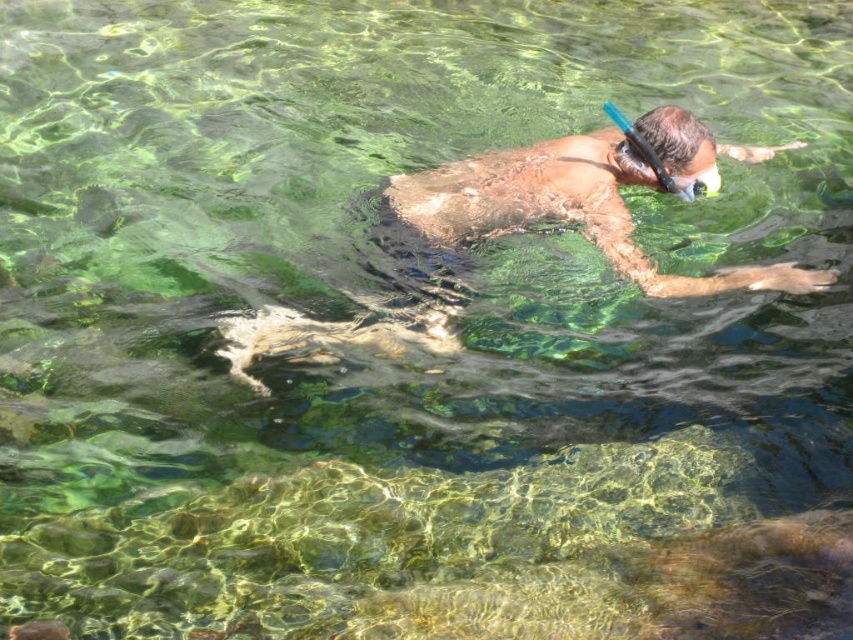
Who is lower down, smooth skin diver at center or blue rubber snorkel at upper center?

smooth skin diver at center is below.

Is smooth skin diver at center taller than blue rubber snorkel at upper center?

Yes.

Where is `smooth skin diver at center`? The image size is (853, 640). smooth skin diver at center is located at coordinates (584, 198).

This screenshot has height=640, width=853. Identify the location of smooth skin diver at center. (584, 198).